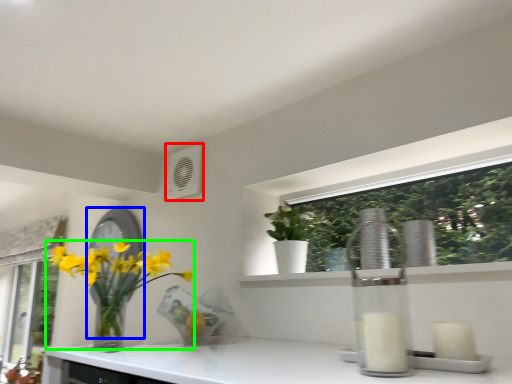
Question: Which object is the farthest from air conditioning (highlighted by a red box)? Choose among these: mirror (highlighted by a blue box) or houseplant (highlighted by a green box).

Choices:
 (A) mirror
 (B) houseplant

Answer: (B)